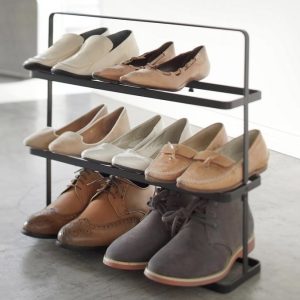
Find the location of a particular element. This screenshot has width=300, height=300. shoes on top shelf is located at coordinates (167, 85), (115, 76), (84, 74), (45, 62).